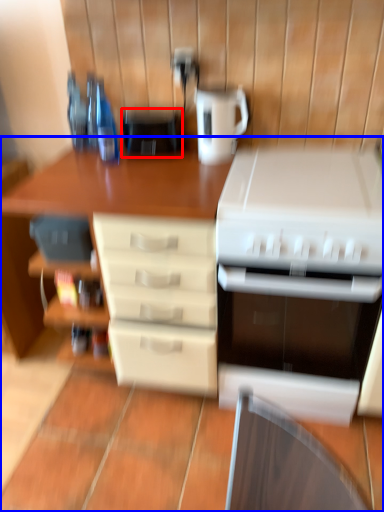
Question: Which object appears closest to the camera in this image, appliance (highlighted by a red box) or desk (highlighted by a blue box)?

Choices:
 (A) appliance
 (B) desk

Answer: (B)